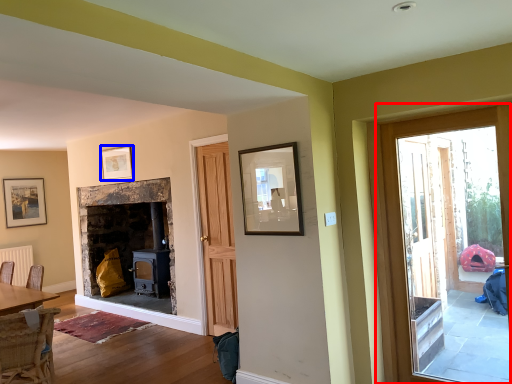
Question: Among these objects, which one is farthest to the camera, door (highlighted by a red box) or picture frame (highlighted by a blue box)?

Choices:
 (A) door
 (B) picture frame

Answer: (B)